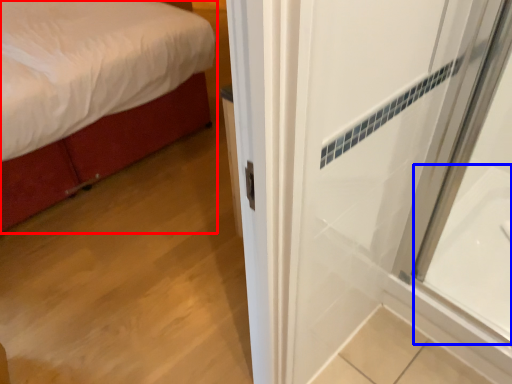
Question: Which point is further to the camera, bed (highlighted by a red box) or bath (highlighted by a blue box)?

Choices:
 (A) bed
 (B) bath

Answer: (A)